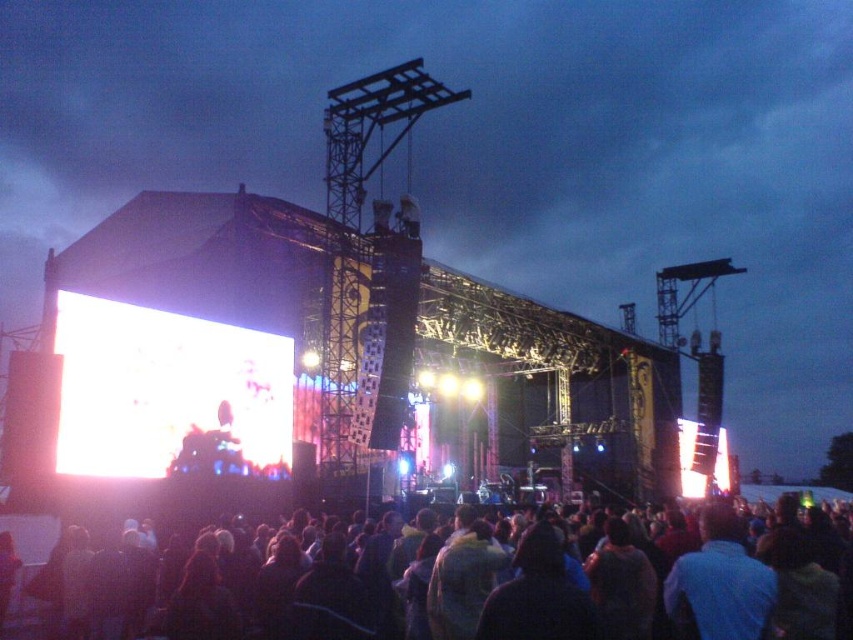
You are a photographer at the concert trying to capture a photo of the bright white screen at center without the dark fabric crowd at lower center blocking it. Based on their heights, is this possible?

The dark fabric crowd at lower center is shorter than the bright white screen at center, so it is possible to capture the bright white screen at center without obstruction by positioning the camera higher or angling the shot upwards.